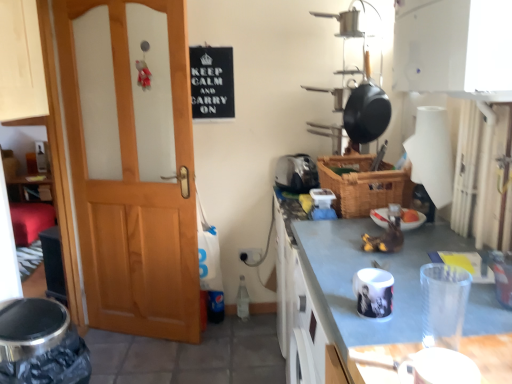
Locate an element on the screen. The width and height of the screenshot is (512, 384). white glossy mug at center, the second appliance positioned from the front is located at coordinates (374, 293).

What are the coordinates of `clear plastic bottle at lower center` in the screenshot? It's located at (242, 300).

What is the approximate height of satin silver toaster at center, which is counted as the 4th appliance, starting from the bottom?

8.30 inches.

At what (x,y) coordinates should I click in order to perform the action: click on satin silver toaster at center, which is counted as the fourth appliance, starting from the front. Please return your answer as a coordinate pair (x, y). Image resolution: width=512 pixels, height=384 pixels. Looking at the image, I should click on (296, 173).

In order to face wooden door at left, should I rotate leftwards or rightwards?

Turn left approximately 16.540 degrees to face it.

You are a GUI agent. You are given a task and a screenshot of the screen. Output one action in this format:
    pyautogui.click(x=<x>, y=<y>)
    Task: Click on the white glossy cabinet at upper center
    This screenshot has width=512, height=384.
    Given the screenshot: What is the action you would take?
    click(x=352, y=276)

The width and height of the screenshot is (512, 384). I want to click on black matte sign at upper center, so click(x=212, y=82).

This screenshot has height=384, width=512. What do you see at coordinates (212, 82) in the screenshot?
I see `black matte sign at upper center` at bounding box center [212, 82].

The width and height of the screenshot is (512, 384). Find the location of `white glossy mug at center, the second appliance positioned from the front`. white glossy mug at center, the second appliance positioned from the front is located at coordinates (374, 293).

Which object is positioned more to the left, satin silver toaster at center, marked as the 1th appliance in a back-to-front arrangement, or clear plastic bottle at lower center?

clear plastic bottle at lower center is more to the left.

Considering the positions of objects satin silver toaster at center, the 1th appliance positioned from the top, and clear plastic bottle at lower center in the image provided, who is in front, satin silver toaster at center, the 1th appliance positioned from the top, or clear plastic bottle at lower center?

satin silver toaster at center, the 1th appliance positioned from the top, is closer to the camera.

Is satin silver toaster at center, marked as the 1th appliance in a back-to-front arrangement, completely or partially outside of clear plastic bottle at lower center?

Yes.

From a real-world perspective, is satin silver toaster at center, the 1th appliance positioned from the top, located higher than clear plastic bottle at lower center?

Yes, from a real-world perspective, satin silver toaster at center, the 1th appliance positioned from the top, is above clear plastic bottle at lower center.

Are wooden door at left and black matte sign at upper center far apart?

No, wooden door at left is not far away from black matte sign at upper center.

From a real-world perspective, does wooden door at left sit lower than black matte sign at upper center?

Yes.

Considering the sizes of wooden door at left and black matte sign at upper center in the image, is wooden door at left wider or thinner than black matte sign at upper center?

Clearly, wooden door at left has more width compared to black matte sign at upper center.

Considering the positions of objects wooden door at left and black matte sign at upper center in the image provided, who is more to the left, wooden door at left or black matte sign at upper center?

wooden door at left.

Which object is closer to the camera, white glossy mug at center, positioned as the third appliance in back-to-front order, or white glossy cabinet at upper center?

white glossy mug at center, positioned as the third appliance in back-to-front order, is closer to the camera.

Is white glossy mug at center, the second appliance positioned from the front, wider or thinner than white glossy cabinet at upper center?

white glossy mug at center, the second appliance positioned from the front, is thinner than white glossy cabinet at upper center.

Considering the relative sizes of white glossy mug at center, placed as the 1th appliance when sorted from bottom to top, and white glossy cabinet at upper center in the image provided, is white glossy mug at center, placed as the 1th appliance when sorted from bottom to top, smaller than white glossy cabinet at upper center?

Yes.

Which is more to the left, white glossy mug at center, the second appliance positioned from the front, or white glossy cabinet at upper center?

Positioned to the left is white glossy mug at center, the second appliance positioned from the front.

Is point (403, 198) in front of point (244, 306)?

Yes, point (403, 198) is in front of point (244, 306).

Is woven brown basket at center facing towards clear plastic bottle at lower center?

No.

Is woven brown basket at center taller than clear plastic bottle at lower center?

Incorrect, the height of woven brown basket at center is not larger of that of clear plastic bottle at lower center.

Is woven brown basket at center positioned far away from clear plastic bottle at lower center?

woven brown basket at center is positioned a significant distance from clear plastic bottle at lower center.

Consider the image. Does clear plastic bottle at lower center have a smaller size compared to white glossy cabinet at upper center?

Yes.

Is clear plastic bottle at lower center positioned beyond the bounds of white glossy cabinet at upper center?

Yes, clear plastic bottle at lower center is not within white glossy cabinet at upper center.

From a real-world perspective, between clear plastic bottle at lower center and white glossy cabinet at upper center, who is vertically higher?

In real-world perspective, white glossy cabinet at upper center is above.

Is clear plastic bottle at lower center placed right next to white glossy cabinet at upper center?

clear plastic bottle at lower center is not next to white glossy cabinet at upper center, and they're not touching.

From the image's perspective, would you say white glossy plate at center, which ranks as the 2th appliance in top-to-bottom order, is shown under wooden door at left?

Yes.

Between white glossy plate at center, which ranks as the 2th appliance in top-to-bottom order, and wooden door at left, which one has larger width?

white glossy plate at center, which ranks as the 2th appliance in top-to-bottom order.

Identify the location of door that appears behind the white glossy plate at center, positioned as the third appliance in front-to-back order. The width and height of the screenshot is (512, 384). (134, 194).

Is white glossy plate at center, positioned as the third appliance in front-to-back order, far away from black matte sign at upper center?

Yes, white glossy plate at center, positioned as the third appliance in front-to-back order, is far from black matte sign at upper center.

Can you confirm if white glossy plate at center, which ranks as the 2th appliance in top-to-bottom order, is positioned to the left of black matte sign at upper center?

In fact, white glossy plate at center, which ranks as the 2th appliance in top-to-bottom order, is to the right of black matte sign at upper center.

From a real-world perspective, which is physically above, white glossy plate at center, which ranks as the 2th appliance in top-to-bottom order, or black matte sign at upper center?

In real-world perspective, black matte sign at upper center is above.

Which is closer to the camera, (379,214) or (227,78)?

Positioned in front is point (379,214).

From the image's perspective, count 4th appliances upward from the clear plastic bottle at lower center and point to it. Please provide its 2D coordinates.

[(296, 173)]

Locate an element on the screen. The image size is (512, 384). door in front of the black matte sign at upper center is located at coordinates (134, 194).

Looking at the image, which one is located further to clear plastic bottle at lower center, wooden door at left or black matte sign at upper center?

black matte sign at upper center is positioned further to the anchor clear plastic bottle at lower center.

From the image, which object appears to be farther from white glossy mug at center, positioned as the third appliance in back-to-front order, white glossy cabinet at upper center or transparent plastic cup at lower right, the third appliance positioned from the top?

Among the two, white glossy cabinet at upper center is located further to white glossy mug at center, positioned as the third appliance in back-to-front order.

Looking at the image, which one is located further to white glossy plate at center, positioned as the third appliance in front-to-back order, transparent plastic cup at lower right, placed as the 2th appliance when sorted from bottom to top, or satin silver toaster at center, which is counted as the 4th appliance, starting from the bottom?

The object further to white glossy plate at center, positioned as the third appliance in front-to-back order, is satin silver toaster at center, which is counted as the 4th appliance, starting from the bottom.

Estimate the real-world distances between objects in this image. Which object is closer to satin silver toaster at center, which is counted as the fourth appliance, starting from the front, white glossy cabinet at upper center or wooden door at left?

white glossy cabinet at upper center.

Which object lies further to the anchor point clear plastic bottle at lower center, woven brown basket at center or transparent plastic cup at lower right, placed as the 2th appliance when sorted from bottom to top?

The object further to clear plastic bottle at lower center is transparent plastic cup at lower right, placed as the 2th appliance when sorted from bottom to top.

From the image, which object appears to be nearer to satin silver toaster at center, which is counted as the 4th appliance, starting from the bottom, black matte sign at upper center or white glossy mug at center, the second appliance positioned from the front?

black matte sign at upper center lies closer to satin silver toaster at center, which is counted as the 4th appliance, starting from the bottom, than the other object.

Based on their spatial positions, is clear plastic bottle at lower center or wooden door at left further from woven brown basket at center?

clear plastic bottle at lower center lies further to woven brown basket at center than the other object.

Which object lies nearer to the anchor point white glossy plate at center, positioned as the third appliance in front-to-back order, wooden door at left or transparent plastic cup at lower right, placed as the 2th appliance when sorted from bottom to top?

Among the two, transparent plastic cup at lower right, placed as the 2th appliance when sorted from bottom to top, is located nearer to white glossy plate at center, positioned as the third appliance in front-to-back order.

Locate an element on the screen. The height and width of the screenshot is (384, 512). bulletin board between white glossy cabinet at upper center and clear plastic bottle at lower center from front to back is located at coordinates (212, 82).

In order to click on door between white glossy mug at center, placed as the 1th appliance when sorted from bottom to top, and black matte sign at upper center, along the z-axis in this screenshot , I will do `click(134, 194)`.

Where is `door located between white glossy cabinet at upper center and black matte sign at upper center in the depth direction`? The width and height of the screenshot is (512, 384). door located between white glossy cabinet at upper center and black matte sign at upper center in the depth direction is located at coordinates (134, 194).

Where is `basket between transparent plastic cup at lower right, arranged as the first appliance when viewed from the front, and satin silver toaster at center, which is counted as the 4th appliance, starting from the bottom, from front to back`? basket between transparent plastic cup at lower right, arranged as the first appliance when viewed from the front, and satin silver toaster at center, which is counted as the 4th appliance, starting from the bottom, from front to back is located at coordinates (362, 185).